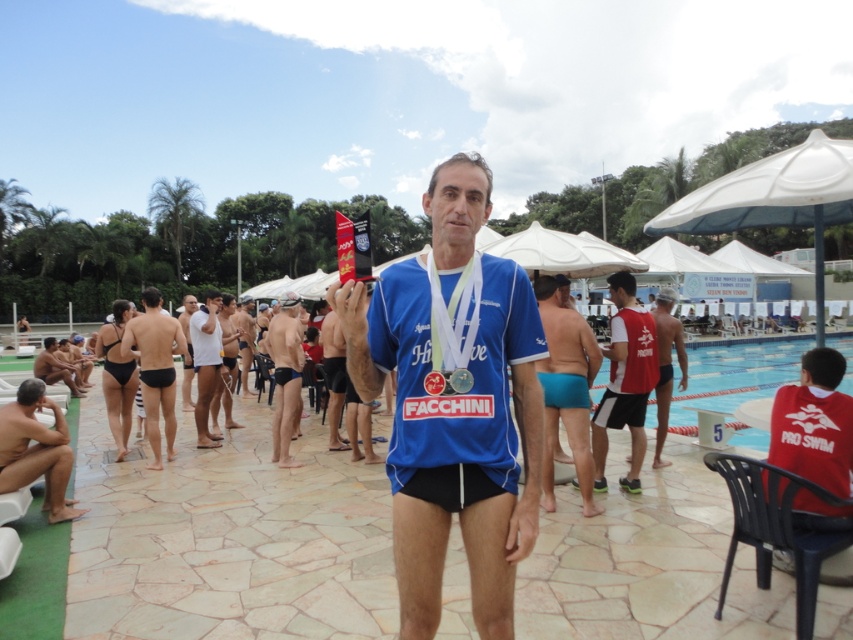
Question: Which point is farther from the camera taking this photo?

Choices:
 (A) (218, 348)
 (B) (297, 413)

Answer: (A)

Question: From the image, what is the correct spatial relationship of blue fabric shirt at center in relation to red matte jersey at lower right?

Choices:
 (A) left
 (B) right

Answer: (A)

Question: Based on their relative distances, which object is farther from the matte blue swim trunks at center?

Choices:
 (A) black matte swim trunks at center
 (B) nude skin at lower left

Answer: (B)

Question: Is blue tile swimming pool at center thinner than nude skin at lower left?

Choices:
 (A) no
 (B) yes

Answer: (A)

Question: Is turquoise matte swim trunks at center bigger than white matte shorts at center?

Choices:
 (A) no
 (B) yes

Answer: (A)

Question: Which object appears closest to the camera in this image?

Choices:
 (A) blue fabric shirt at center
 (B) red matte jersey at lower right
 (C) matte black swim trunks at center
 (D) blue tile swimming pool at center

Answer: (A)